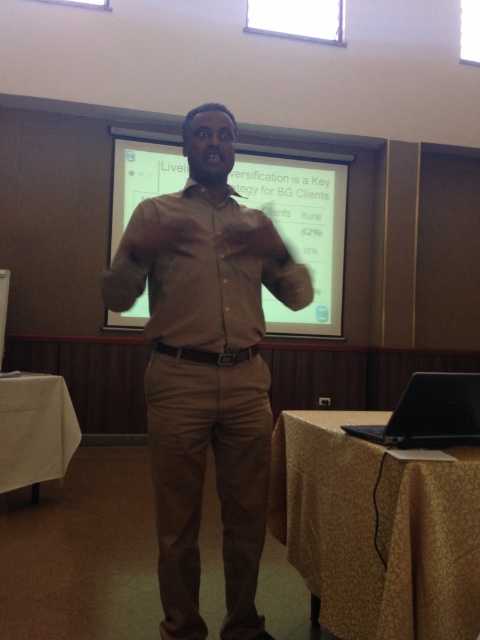
Between point (427, 592) and point (55, 417), which one is positioned behind?

The point (55, 417) is more distant.

Who is shorter, yellow fabric table at lower right or white cloth at lower left?

Standing shorter between the two is yellow fabric table at lower right.

Does point (478, 499) come in front of point (39, 456)?

Yes, point (478, 499) is in front of point (39, 456).

At what (x,y) coordinates should I click in order to perform the action: click on yellow fabric table at lower right. Please return your answer as a coordinate pair (x, y). Image resolution: width=480 pixels, height=640 pixels. Looking at the image, I should click on (376, 529).

Does white matte projection screen at upper center appear on the right side of black matte laptop at lower right?

Yes, white matte projection screen at upper center is to the right of black matte laptop at lower right.

Image resolution: width=480 pixels, height=640 pixels. What do you see at coordinates (300, 228) in the screenshot?
I see `white matte projection screen at upper center` at bounding box center [300, 228].

Locate an element on the screen. The height and width of the screenshot is (640, 480). white matte projection screen at upper center is located at coordinates (300, 228).

Find the location of a particular element. This screenshot has height=640, width=480. white matte projection screen at upper center is located at coordinates pyautogui.click(x=300, y=228).

How far apart are matte khaki shirt at center and yellow fabric table at lower right?

A distance of 19.07 inches exists between matte khaki shirt at center and yellow fabric table at lower right.

Identify the location of matte khaki shirt at center. Image resolution: width=480 pixels, height=640 pixels. [x=206, y=369].

Identify the location of matte khaki shirt at center. This screenshot has width=480, height=640. (206, 369).